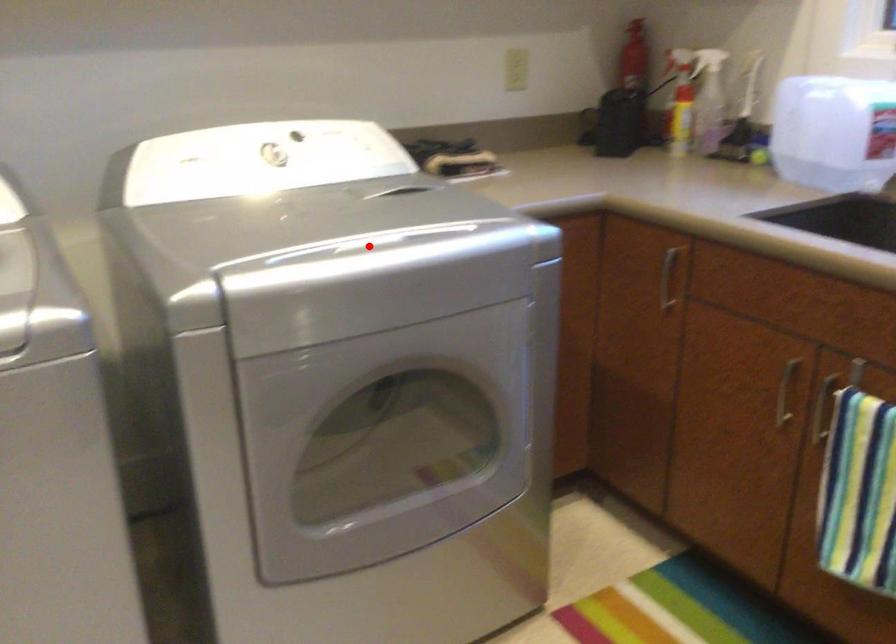
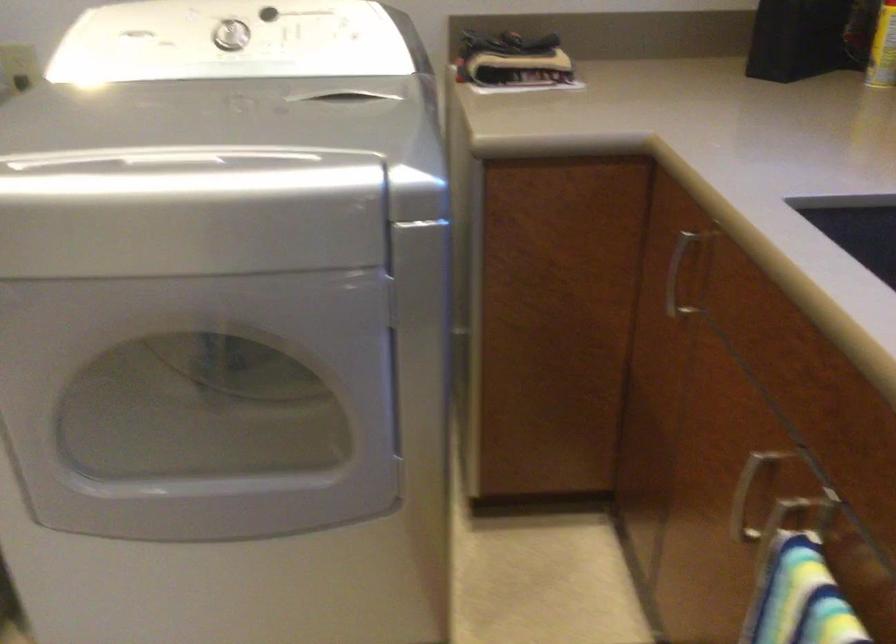
Question: A red point is marked in image1. In image2, is the corresponding 3D point closer to the camera or farther? Reply with the corresponding letter.

Choices:
 (A) The corresponding 3D point is closer.
 (B) The corresponding 3D point is farther.

Answer: (A)